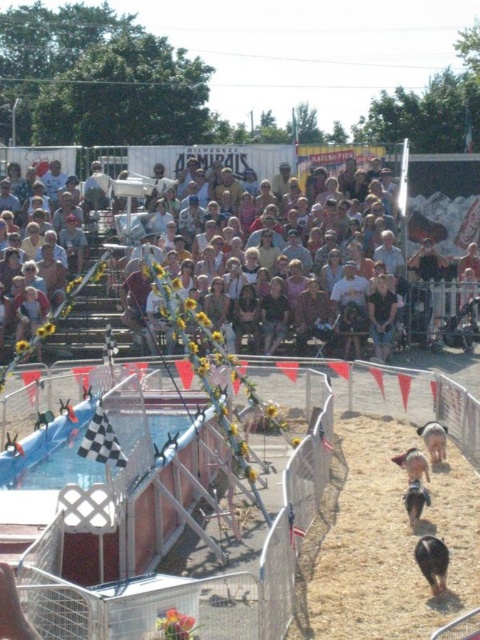
Question: Can you confirm if brown dirt track at lower right is positioned to the right of brown fuzzy pig at lower right?

Choices:
 (A) yes
 (B) no

Answer: (B)

Question: Observing the image, what is the correct spatial positioning of dark blue shirt at center in reference to white woolen sheep at center?

Choices:
 (A) left
 (B) right

Answer: (A)

Question: Which of these objects is positioned farthest from the brown dirt track at lower right?

Choices:
 (A) brown fuzzy pig at lower right
 (B) white woolen sheep at center
 (C) matte yellow sunflowers at upper center
 (D) dark brown hair at center

Answer: (C)

Question: Can you confirm if matte yellow sunflowers at upper center is positioned to the right of white woolen sheep at center?

Choices:
 (A) yes
 (B) no

Answer: (B)

Question: Which point is farther from the camera taking this photo?

Choices:
 (A) [x=432, y=436]
 (B) [x=429, y=340]
 (C) [x=386, y=333]
 (D) [x=432, y=573]

Answer: (B)

Question: Among these points, which one is farthest from the camera?

Choices:
 (A) (313, 556)
 (B) (414, 480)

Answer: (B)